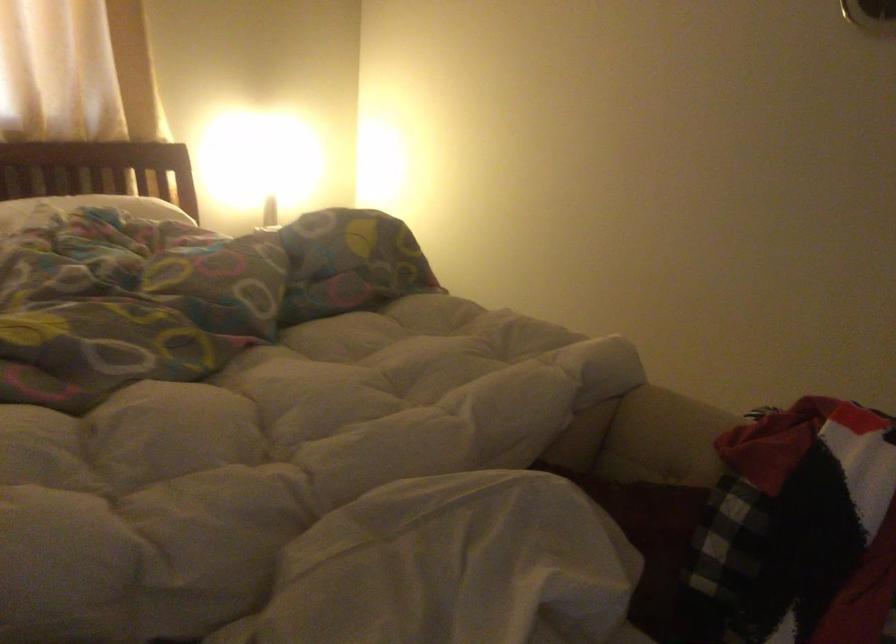
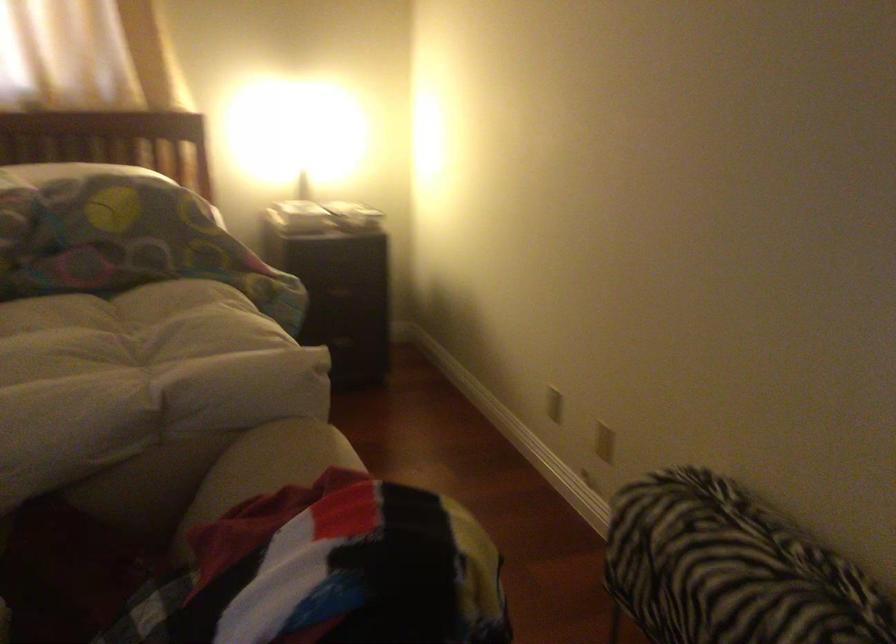
The images are taken continuously from a first-person perspective. In which direction are you moving?

The movement direction of the cameraman is right, forward.